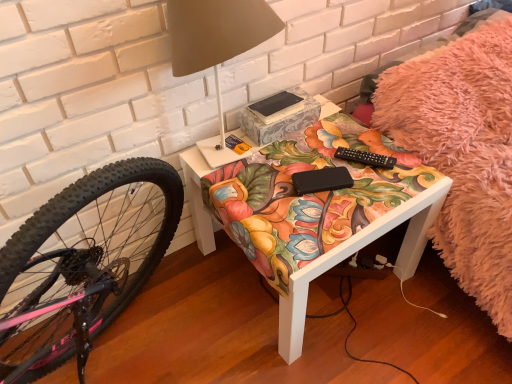
Question: Would you consider black matte book at center to be distant from matte white table lamp at upper center?

Choices:
 (A) no
 (B) yes

Answer: (A)

Question: From a real-world perspective, does black matte book at center stand above matte white table lamp at upper center?

Choices:
 (A) yes
 (B) no

Answer: (B)

Question: Is black matte book at center to the right of matte white table lamp at upper center from the viewer's perspective?

Choices:
 (A) yes
 (B) no

Answer: (A)

Question: Is black matte book at center thinner than matte white table lamp at upper center?

Choices:
 (A) yes
 (B) no

Answer: (A)

Question: Is matte white table lamp at upper center at the back of black matte book at center?

Choices:
 (A) yes
 (B) no

Answer: (B)

Question: Can you confirm if black matte book at center is smaller than matte white table lamp at upper center?

Choices:
 (A) no
 (B) yes

Answer: (B)

Question: Does matte white table lamp at upper center come behind matte floral-patterned table at center?

Choices:
 (A) yes
 (B) no

Answer: (B)

Question: From a real-world perspective, is matte white table lamp at upper center located higher than matte floral-patterned table at center?

Choices:
 (A) no
 (B) yes

Answer: (B)

Question: From the image's perspective, is matte white table lamp at upper center below matte floral-patterned table at center?

Choices:
 (A) yes
 (B) no

Answer: (B)

Question: Does matte white table lamp at upper center have a greater width compared to matte floral-patterned table at center?

Choices:
 (A) no
 (B) yes

Answer: (A)

Question: Is matte white table lamp at upper center shorter than matte floral-patterned table at center?

Choices:
 (A) no
 (B) yes

Answer: (A)

Question: Is matte white table lamp at upper center not near matte floral-patterned table at center?

Choices:
 (A) yes
 (B) no

Answer: (B)

Question: Is black matte book at center shorter than matte floral-patterned table at center?

Choices:
 (A) no
 (B) yes

Answer: (B)